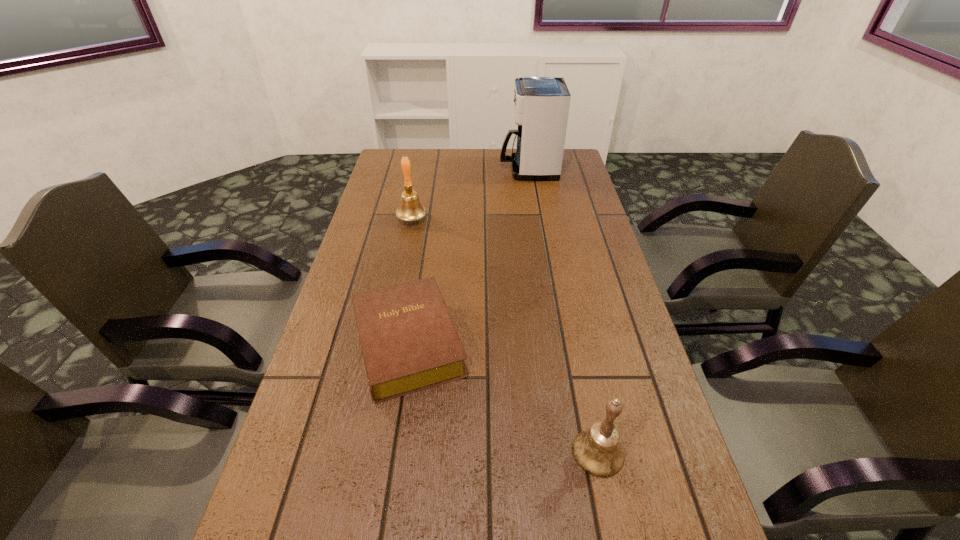
Locate an element on the screen. This screenshot has height=540, width=960. free region at the far edge of the desktop is located at coordinates (465, 152).

Locate an element on the screen. vacant space at the left edge of the desktop is located at coordinates (346, 326).

You are a GUI agent. You are given a task and a screenshot of the screen. Output one action in this format:
    pyautogui.click(x=<x>, y=<y>)
    Task: Click on the vacant space at the right edge of the desktop
    Image resolution: width=960 pixels, height=540 pixels.
    Given the screenshot: What is the action you would take?
    pyautogui.click(x=602, y=234)

You are a GUI agent. You are given a task and a screenshot of the screen. Output one action in this format:
    pyautogui.click(x=<x>, y=<y>)
    Task: Click on the vacant space that's between the left bell and the second nearest object
    
    Given the screenshot: What is the action you would take?
    pyautogui.click(x=410, y=281)

This screenshot has width=960, height=540. I want to click on free spot between the farthest object and the farther bell, so pyautogui.click(x=470, y=194).

Image resolution: width=960 pixels, height=540 pixels. Find the location of `free spot between the third shortest object and the coffee maker`. free spot between the third shortest object and the coffee maker is located at coordinates (470, 194).

The height and width of the screenshot is (540, 960). In order to click on vacant space that is in between the Bible and the tallest object in this screenshot , I will do `click(468, 256)`.

Identify the location of object that can be found as the second closest to the second farthest object. (541, 104).

Image resolution: width=960 pixels, height=540 pixels. Find the location of `the third closest object to the coffee maker`. the third closest object to the coffee maker is located at coordinates (597, 450).

Find the location of a particular element. Image resolution: width=960 pixels, height=540 pixels. vacant region that satisfies the following two spatial constraints: 1. on the front panel of the tallest object; 2. on the left side of the shorter bell is located at coordinates (575, 452).